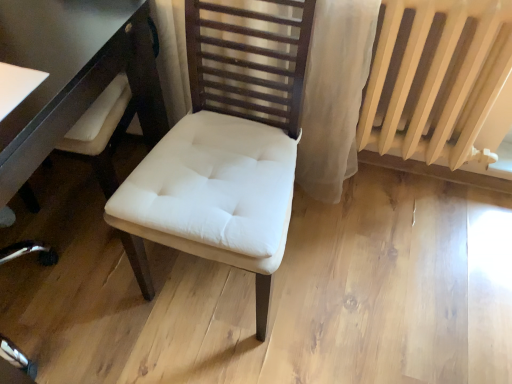
You are a GUI agent. You are given a task and a screenshot of the screen. Output one action in this format:
    pyautogui.click(x=<x>, y=<y>)
    Task: Click on the white fabric chair at center
    This screenshot has height=384, width=512.
    Given the screenshot: What is the action you would take?
    pyautogui.click(x=228, y=144)

This screenshot has height=384, width=512. In order to click on beige painted radiator at right in this screenshot , I will do `click(440, 81)`.

Describe the element at coordinates (72, 73) in the screenshot. I see `white glossy table at left` at that location.

Locate an element on the screen. The height and width of the screenshot is (384, 512). white fabric chair at center is located at coordinates (228, 144).

Where is `radiator below the white glossy table at left (from the image's perspective)`? This screenshot has height=384, width=512. radiator below the white glossy table at left (from the image's perspective) is located at coordinates (440, 81).

Do you think white glossy table at left is within beige painted radiator at right, or outside of it?

white glossy table at left exists outside the volume of beige painted radiator at right.

How different are the orientations of white glossy table at left and beige painted radiator at right in degrees?

0.931 degrees separate the facing orientations of white glossy table at left and beige painted radiator at right.

Is white glossy table at left facing towards beige painted radiator at right?

No, white glossy table at left does not turn towards beige painted radiator at right.

This screenshot has width=512, height=384. Find the location of `chair lying in front of the beige painted radiator at right`. chair lying in front of the beige painted radiator at right is located at coordinates (228, 144).

Considering the sizes of objects beige painted radiator at right and white fabric chair at center in the image provided, who is wider, beige painted radiator at right or white fabric chair at center?

With larger width is white fabric chair at center.

Choose the correct answer: Is beige painted radiator at right inside white fabric chair at center or outside it?

beige painted radiator at right is spatially situated outside white fabric chair at center.

From a real-world perspective, does beige painted radiator at right stand above white fabric chair at center?

Yes, from a real-world perspective, beige painted radiator at right is on top of white fabric chair at center.

Which object is further away from the camera taking this photo, white glossy table at left or white fabric chair at center?

white glossy table at left is more distant.

Locate an element on the screen. The height and width of the screenshot is (384, 512). chair on the right of white glossy table at left is located at coordinates coord(228,144).

Is white glossy table at left positioned far away from white fabric chair at center?

No, white glossy table at left is not far from white fabric chair at center.

Is white glossy table at left to the left of white fabric chair at center from the viewer's perspective?

Correct, you'll find white glossy table at left to the left of white fabric chair at center.

Between white fabric chair at center and white glossy table at left, which one has smaller width?

With smaller width is white fabric chair at center.

Find the location of a particular element. This screenshot has width=512, height=384. table directly beneath the white fabric chair at center (from a real-world perspective) is located at coordinates (72, 73).

Is white fabric chair at center taller than white glossy table at left?

Correct, white fabric chair at center is much taller as white glossy table at left.

Is white fabric chair at center far away from white glossy table at left?

Actually, white fabric chair at center and white glossy table at left are a little close together.

From a real-world perspective, is beige painted radiator at right below white glossy table at left?

No, from a real-world perspective, beige painted radiator at right is not below white glossy table at left.

From the image's perspective, who appears lower, beige painted radiator at right or white glossy table at left?

beige painted radiator at right.

Locate an element on the screen. radiator that appears above the white glossy table at left (from a real-world perspective) is located at coordinates (440, 81).

Consider the image. Which point is more forward, (253, 16) or (402, 54)?

The point (253, 16) is in front.

Is white fabric chair at center closer to camera compared to beige painted radiator at right?

That is True.

Is white fabric chair at center wider than beige painted radiator at right?

Yes, white fabric chair at center is wider than beige painted radiator at right.

From a real-world perspective, is white fabric chair at center located beneath beige painted radiator at right?

Yes, from a real-world perspective, white fabric chair at center is beneath beige painted radiator at right.

Locate an element on the screen. The image size is (512, 384). radiator above the white glossy table at left (from a real-world perspective) is located at coordinates (440, 81).

The width and height of the screenshot is (512, 384). What are the coordinates of `chair that appears below the beige painted radiator at right (from a real-world perspective)` in the screenshot? It's located at (228, 144).

Looking at the image, which one is located further to white fabric chair at center, beige painted radiator at right or white glossy table at left?

beige painted radiator at right is further to white fabric chair at center.

From the image, which object appears to be nearer to beige painted radiator at right, white fabric chair at center or white glossy table at left?

white fabric chair at center.

From the image, which object appears to be nearer to white glossy table at left, white fabric chair at center or beige painted radiator at right?

white fabric chair at center is positioned closer to the anchor white glossy table at left.

Which object lies nearer to the anchor point white fabric chair at center, white glossy table at left or beige painted radiator at right?

The object closer to white fabric chair at center is white glossy table at left.

Considering their positions, is beige painted radiator at right positioned further to white glossy table at left than white fabric chair at center?

beige painted radiator at right is positioned further to the anchor white glossy table at left.

Considering their positions, is white glossy table at left positioned further to beige painted radiator at right than white fabric chair at center?

Based on the image, white glossy table at left appears to be further to beige painted radiator at right.

Where is `chair between white glossy table at left and beige painted radiator at right`? This screenshot has height=384, width=512. chair between white glossy table at left and beige painted radiator at right is located at coordinates (228, 144).